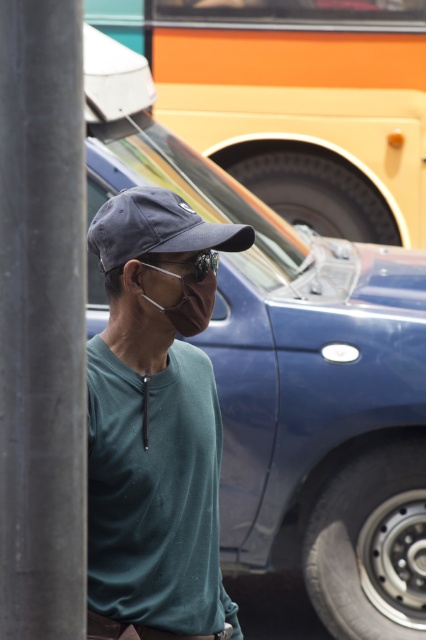
You are a photographer trying to capture the matte green shirt at center and the smooth gray pole at left in the same frame. Given their sizes, which object will appear bigger in your photo?

The matte green shirt at center will appear bigger in the photo because it is larger in size than the smooth gray pole at left.

You are standing at the center of the street and see the smooth gray pole at left. Based on its coordinates, is the pole closer to the left or right side of the image?

The smooth gray pole at left is located at point 0.502 on the x and 0.099 on the y. Since the x coordinate is 0.502, which is just over halfway to the right, the pole is closer to the left side of the image.